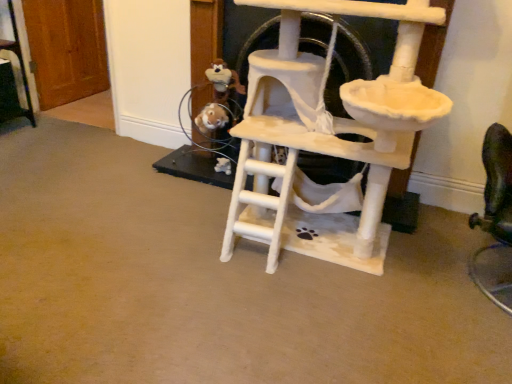
Where is `free space on the front side of white fabric cat tree at center`? free space on the front side of white fabric cat tree at center is located at coordinates pyautogui.click(x=306, y=336).